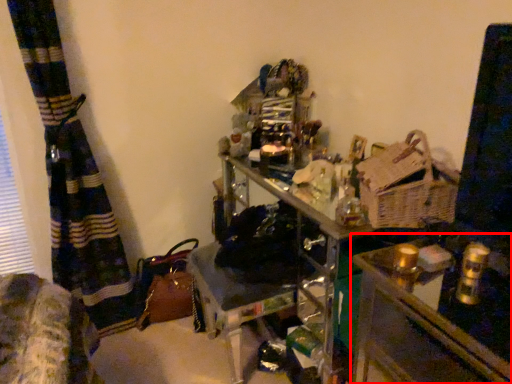
Question: From the image's perspective, where is table (annotated by the red box) located relative to basket?

Choices:
 (A) below
 (B) above

Answer: (A)